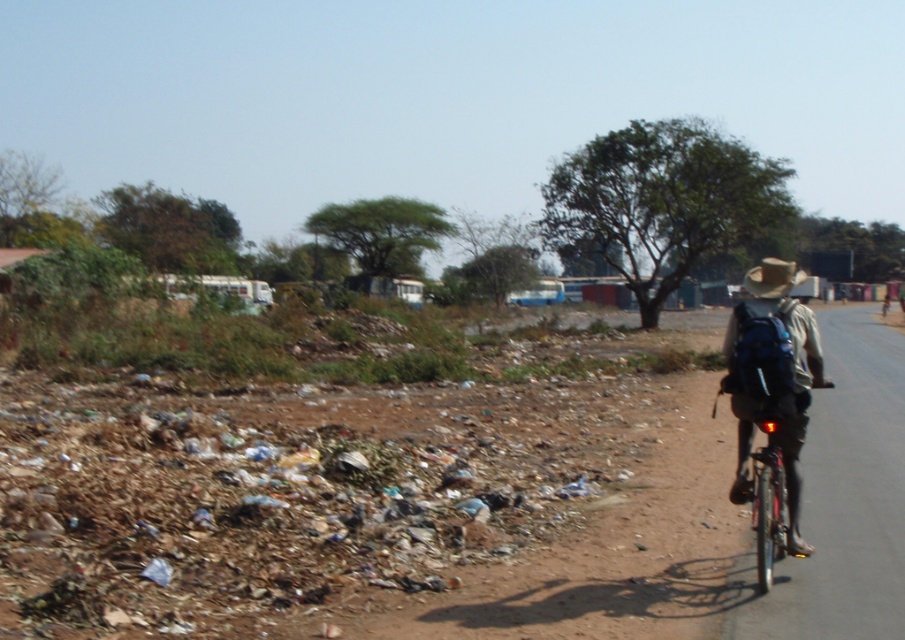
You are a photographer trying to capture the shiny metallic bicycle at right and the brown straw hat at right in the same frame. Since you want to emphasize both objects equally, which object should you move closer to in order to make them appear the same size in your photo?

The shiny metallic bicycle at right has a lesser width compared to brown straw hat at right. To make them appear the same size in the photo, you should move closer to the shiny metallic bicycle at right so that its larger proximity compensates for its smaller width, balancing the sizes of both objects in the frame.

You are standing at the point marked as point (757, 547) and want to walk towards the point marked as point (751, 284). Considering the debris pile to the left of the road, will you have to walk through the debris area to reach your destination?

No, you will not have to walk through the debris area because point (757, 547) is closer to the camera than point (751, 284), meaning the debris pile is located to the left of the road and you can stay on the road path to reach your destination.